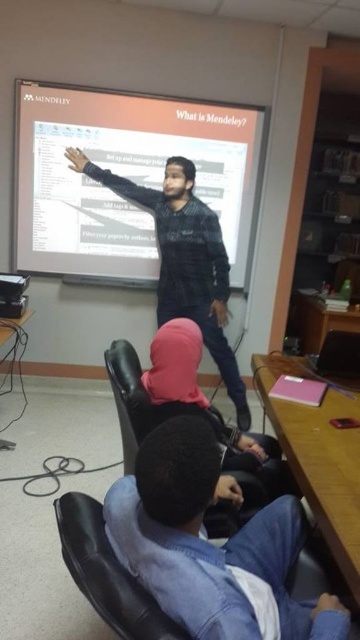
Question: Does black textured sweater at center appear under black leather chair at lower center?

Choices:
 (A) no
 (B) yes

Answer: (A)

Question: Among these points, which one is nearest to the camera?

Choices:
 (A) (106, 211)
 (B) (123, 349)

Answer: (B)

Question: Estimate the real-world distances between objects in this image. Which object is closer to the black leather chair at lower center?

Choices:
 (A) white matte projector screen at upper center
 (B) black textured sweater at center
 (C) blue denim jacket at lower right

Answer: (C)

Question: Can you confirm if white matte projector screen at upper center is positioned below black textured sweater at center?

Choices:
 (A) yes
 (B) no

Answer: (B)

Question: Estimate the real-world distances between objects in this image. Which object is farther from the white matte projector screen at upper center?

Choices:
 (A) black textured sweater at center
 (B) blue denim jacket at lower right

Answer: (B)

Question: From the image, what is the correct spatial relationship of white matte projector screen at upper center in relation to black textured sweater at center?

Choices:
 (A) below
 (B) above

Answer: (B)